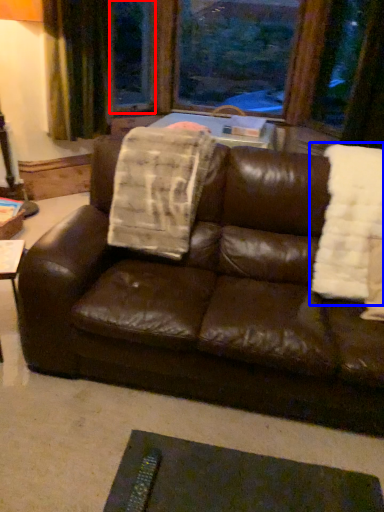
Question: Which object is further to the camera taking this photo, window screen (highlighted by a red box) or blanket (highlighted by a blue box)?

Choices:
 (A) window screen
 (B) blanket

Answer: (A)